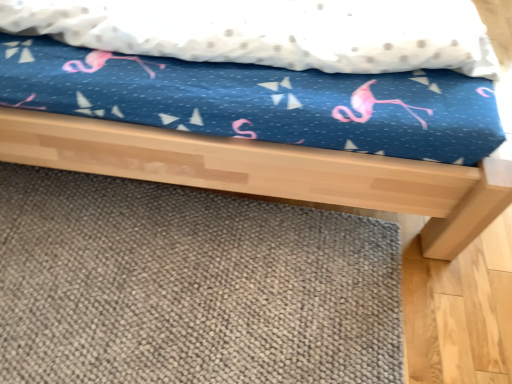
Question: In terms of size, does blue fabric bed at center appear bigger or smaller than gray textured mat at lower center?

Choices:
 (A) small
 (B) big

Answer: (B)

Question: Does point (189, 178) appear closer or farther from the camera than point (79, 236)?

Choices:
 (A) closer
 (B) farther

Answer: (A)

Question: From a real-world perspective, is blue fabric bed at center positioned above or below gray textured mat at lower center?

Choices:
 (A) below
 (B) above

Answer: (B)

Question: In terms of height, does gray textured mat at lower center look taller or shorter compared to blue fabric bed at center?

Choices:
 (A) tall
 (B) short

Answer: (B)

Question: Is gray textured mat at lower center inside or outside of blue fabric bed at center?

Choices:
 (A) outside
 (B) inside

Answer: (A)

Question: From the image's perspective, is gray textured mat at lower center positioned above or below blue fabric bed at center?

Choices:
 (A) below
 (B) above

Answer: (A)

Question: Considering their positions, is gray textured mat at lower center located in front of or behind blue fabric bed at center?

Choices:
 (A) front
 (B) behind

Answer: (B)